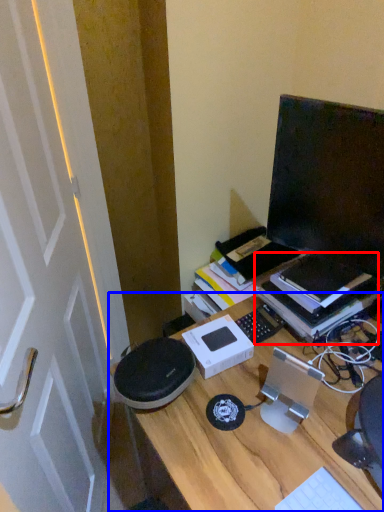
Question: Which point is further to the camera, book (highlighted by a red box) or desk (highlighted by a blue box)?

Choices:
 (A) book
 (B) desk

Answer: (A)